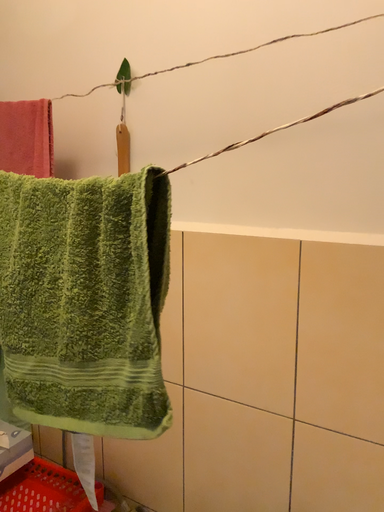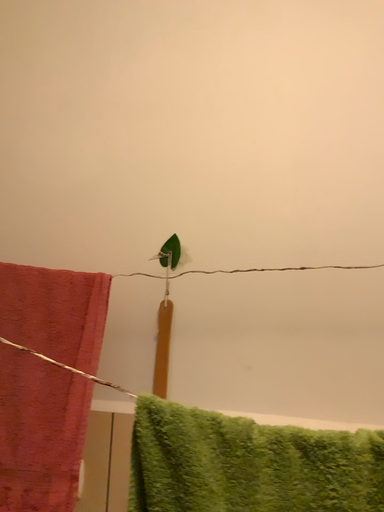
Question: Which way did the camera rotate in the video?

Choices:
 (A) rotated downward
 (B) rotated upward

Answer: (B)